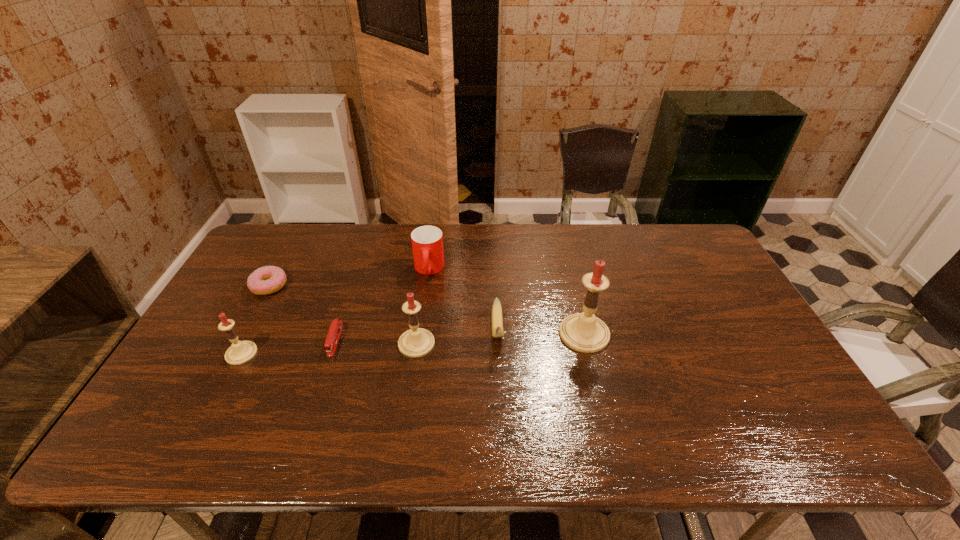
With all candles evenly spaced, where should an extra candle be placed on the right to continue the pattern? Please point out a vacant space. Please provide its 2D coordinates. Your answer should be formatted as a tuple, i.e. [(x, y)], where the tuple contains the x and y coordinates of a point satisfying the conditions above.

[(745, 325)]